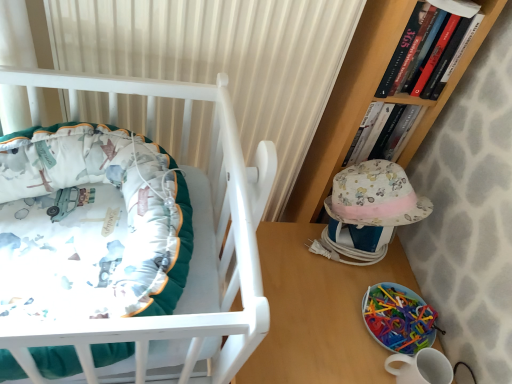
Describe the element at coordinates (387, 133) in the screenshot. This screenshot has width=512, height=384. I see `hardcover book at upper right, the 2th book viewed from the front` at that location.

Identify the location of matte white crib at left. (120, 245).

Find the location of a particular element. The height and width of the screenshot is (384, 512). translucent plastic toy at lower right is located at coordinates (398, 318).

Is matte white crib at left spatially inside wooden table at lower right, or outside of it?

matte white crib at left is located beyond the bounds of wooden table at lower right.

From a real-world perspective, is matte white crib at left on top of wooden table at lower right?

Yes, from a real-world perspective, matte white crib at left is on top of wooden table at lower right.

Between matte white crib at left and wooden table at lower right, which one has larger size?

wooden table at lower right is bigger.

In the image, is translucent plastic toy at lower right positioned in front of or behind hardcover book at upper right, which is counted as the first book, starting from the back?

Visually, translucent plastic toy at lower right is located in front of hardcover book at upper right, which is counted as the first book, starting from the back.

From a real-world perspective, is translucent plastic toy at lower right above or below hardcover book at upper right, the 2th book viewed from the front?

In terms of real-world spatial position, translucent plastic toy at lower right is below hardcover book at upper right, the 2th book viewed from the front.

Could you tell me if translucent plastic toy at lower right is turned towards hardcover book at upper right, the 2th book viewed from the front?

No, translucent plastic toy at lower right is not oriented towards hardcover book at upper right, the 2th book viewed from the front.

Is translucent plastic toy at lower right far away from hardcover book at upper right, which is counted as the first book, starting from the back?

That's not correct — translucent plastic toy at lower right is a little close to hardcover book at upper right, which is counted as the first book, starting from the back.

Can you confirm if matte white crib at left is bigger than translucent plastic toy at lower right?

Yes.

Is matte white crib at left situated inside translucent plastic toy at lower right or outside?

matte white crib at left cannot be found inside translucent plastic toy at lower right.

From the image's perspective, would you say matte white crib at left is shown under translucent plastic toy at lower right?

Incorrect, from the image's perspective, matte white crib at left is higher than translucent plastic toy at lower right.

From a real-world perspective, is hardcover book at upper right, which is counted as the first book, starting from the back, above or below translucent plastic toy at lower right?

Clearly, from a real-world perspective, hardcover book at upper right, which is counted as the first book, starting from the back, is above translucent plastic toy at lower right.

Can we say hardcover book at upper right, the 2th book viewed from the front, lies outside translucent plastic toy at lower right?

hardcover book at upper right, the 2th book viewed from the front, is positioned outside translucent plastic toy at lower right.

Is hardcover book at upper right, which is counted as the first book, starting from the back, aimed at translucent plastic toy at lower right?

Yes, hardcover book at upper right, which is counted as the first book, starting from the back, is turned towards translucent plastic toy at lower right.

From a real-world perspective, does hardcover book at upper right, placed as the second book when sorted from back to front, stand above translucent plastic toy at lower right?

Indeed, from a real-world perspective, hardcover book at upper right, placed as the second book when sorted from back to front, stands above translucent plastic toy at lower right.

From the picture: Which is behind, hardcover book at upper right, which is the first book in front-to-back order, or translucent plastic toy at lower right?

Positioned behind is translucent plastic toy at lower right.

Is hardcover book at upper right, placed as the second book when sorted from back to front, to the right of translucent plastic toy at lower right from the viewer's perspective?

Indeed, hardcover book at upper right, placed as the second book when sorted from back to front, is positioned on the right side of translucent plastic toy at lower right.

From the image's perspective, would you say translucent plastic toy at lower right is positioned over wooden table at lower right?

Yes, from the image's perspective, translucent plastic toy at lower right is over wooden table at lower right.

From the picture: Is translucent plastic toy at lower right aimed at wooden table at lower right?

No, translucent plastic toy at lower right is not facing towards wooden table at lower right.

Locate an element on the screen. This screenshot has height=384, width=512. table below the translucent plastic toy at lower right (from a real-world perspective) is located at coordinates (318, 311).

Considering the sizes of hardcover book at upper right, the 2th book viewed from the front, and hardcover book at upper right, placed as the second book when sorted from back to front, in the image, is hardcover book at upper right, the 2th book viewed from the front, taller or shorter than hardcover book at upper right, placed as the second book when sorted from back to front,?

In the image, hardcover book at upper right, the 2th book viewed from the front, appears to be shorter than hardcover book at upper right, placed as the second book when sorted from back to front.

From a real-world perspective, which object rests below the other?

hardcover book at upper right, which is counted as the first book, starting from the back.

Measure the distance between hardcover book at upper right, the 2th book viewed from the front, and hardcover book at upper right, placed as the second book when sorted from back to front.

hardcover book at upper right, the 2th book viewed from the front, and hardcover book at upper right, placed as the second book when sorted from back to front, are 5.31 inches apart from each other.

Does hardcover book at upper right, which is counted as the first book, starting from the back, turn towards hardcover book at upper right, placed as the second book when sorted from back to front?

No, hardcover book at upper right, which is counted as the first book, starting from the back, is not facing towards hardcover book at upper right, placed as the second book when sorted from back to front.

Where is `table behind the matte white crib at left`? Image resolution: width=512 pixels, height=384 pixels. table behind the matte white crib at left is located at coordinates (318, 311).

Where is `book on the left of translucent plastic toy at lower right`? book on the left of translucent plastic toy at lower right is located at coordinates (387, 133).

Based on their spatial positions, is wooden table at lower right or matte white crib at left further from translucent plastic toy at lower right?

The object further to translucent plastic toy at lower right is matte white crib at left.

Estimate the real-world distances between objects in this image. Which object is further from matte white crib at left, hardcover book at upper right, which is the first book in front-to-back order, or translucent plastic toy at lower right?

hardcover book at upper right, which is the first book in front-to-back order, is further to matte white crib at left.

When comparing their distances from matte white crib at left, does translucent plastic toy at lower right or wooden table at lower right seem further?

Among the two, translucent plastic toy at lower right is located further to matte white crib at left.

Based on their spatial positions, is wooden table at lower right or hardcover book at upper right, the 2th book viewed from the front, closer to matte white crib at left?

wooden table at lower right.

Looking at the image, which one is located closer to matte white crib at left, wooden table at lower right or translucent plastic toy at lower right?

wooden table at lower right is positioned closer to the anchor matte white crib at left.

Estimate the real-world distances between objects in this image. Which object is closer to hardcover book at upper right, which is counted as the first book, starting from the back, hardcover book at upper right, which is the first book in front-to-back order, or wooden table at lower right?

Among the two, hardcover book at upper right, which is the first book in front-to-back order, is located nearer to hardcover book at upper right, which is counted as the first book, starting from the back.

Consider the image. From the image, which object appears to be farther from hardcover book at upper right, placed as the second book when sorted from back to front, translucent plastic toy at lower right or hardcover book at upper right, the 2th book viewed from the front?

translucent plastic toy at lower right lies further to hardcover book at upper right, placed as the second book when sorted from back to front, than the other object.

From the picture: From the image, which object appears to be farther from hardcover book at upper right, which is the first book in front-to-back order, wooden table at lower right or translucent plastic toy at lower right?

Based on the image, translucent plastic toy at lower right appears to be further to hardcover book at upper right, which is the first book in front-to-back order.

Where is `table between matte white crib at left and hardcover book at upper right, which is counted as the first book, starting from the back, from left to right`? This screenshot has height=384, width=512. table between matte white crib at left and hardcover book at upper right, which is counted as the first book, starting from the back, from left to right is located at coordinates (318, 311).

At what (x,y) coordinates should I click in order to perform the action: click on infant bed between hardcover book at upper right, which is the first book in front-to-back order, and wooden table at lower right vertically. Please return your answer as a coordinate pair (x, y). Looking at the image, I should click on (120, 245).

Locate an element on the screen. The width and height of the screenshot is (512, 384). table situated between matte white crib at left and translucent plastic toy at lower right from left to right is located at coordinates (318, 311).

This screenshot has height=384, width=512. In order to click on book that lies between hardcover book at upper right, placed as the second book when sorted from back to front, and wooden table at lower right from top to bottom in this screenshot , I will do `click(387, 133)`.